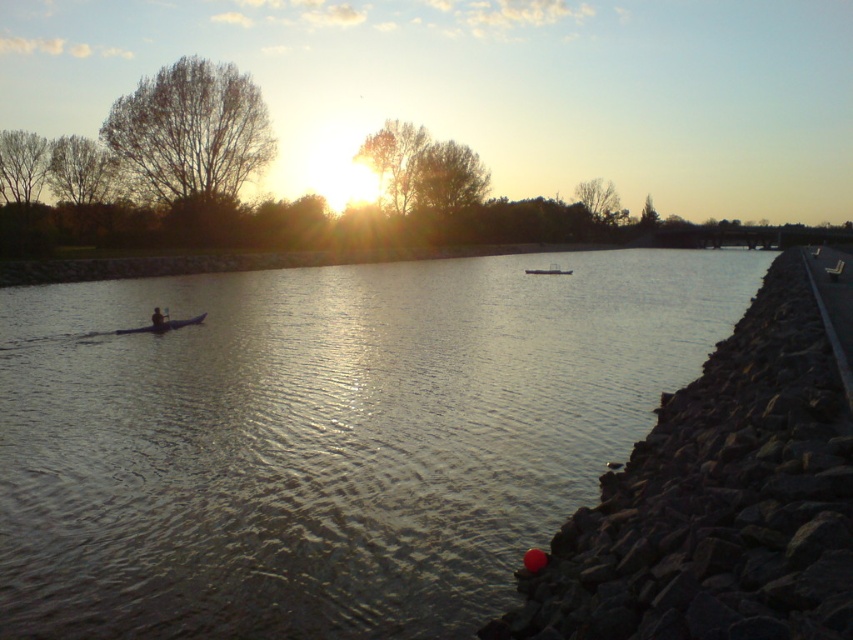
You are a photographer planning to capture the sunset reflection on the river. You have a matte black kayak at left and a metallic silver boat at center in your frame. Which object is closer to the left edge of your photo?

The matte black kayak at left is positioned on the left side of the metallic silver boat at center, so it is closer to the left edge of the photo.

You are a photographer trying to capture the sunset reflection on the water. You see the silvery reflective water at center and the metallic silver boat at center. Which object is positioned to the left of the other?

The silvery reflective water at center is to the left of the metallic silver boat at center.